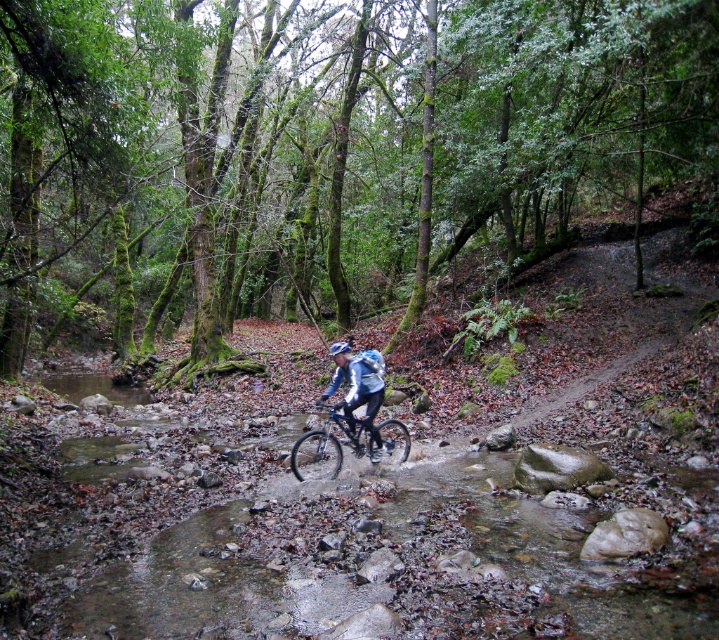
Question: Which of the following is the farthest from the observer?

Choices:
 (A) matte blue jacket at center
 (B) matte blue helmet at center
 (C) shiny metallic bicycle at center

Answer: (B)

Question: Which point is closer to the camera?

Choices:
 (A) (354, 387)
 (B) (145, 276)
 (C) (352, 449)
 (D) (331, 355)

Answer: (A)

Question: Which of the following is the farthest from the observer?

Choices:
 (A) (352, 429)
 (B) (261, 102)
 (C) (349, 346)

Answer: (B)

Question: Can you confirm if green mossy trees at center is wider than matte blue helmet at center?

Choices:
 (A) no
 (B) yes

Answer: (B)

Question: Is green mossy trees at center below matte blue jacket at center?

Choices:
 (A) no
 (B) yes

Answer: (A)

Question: Can you confirm if green mossy trees at center is wider than matte blue jacket at center?

Choices:
 (A) no
 (B) yes

Answer: (B)